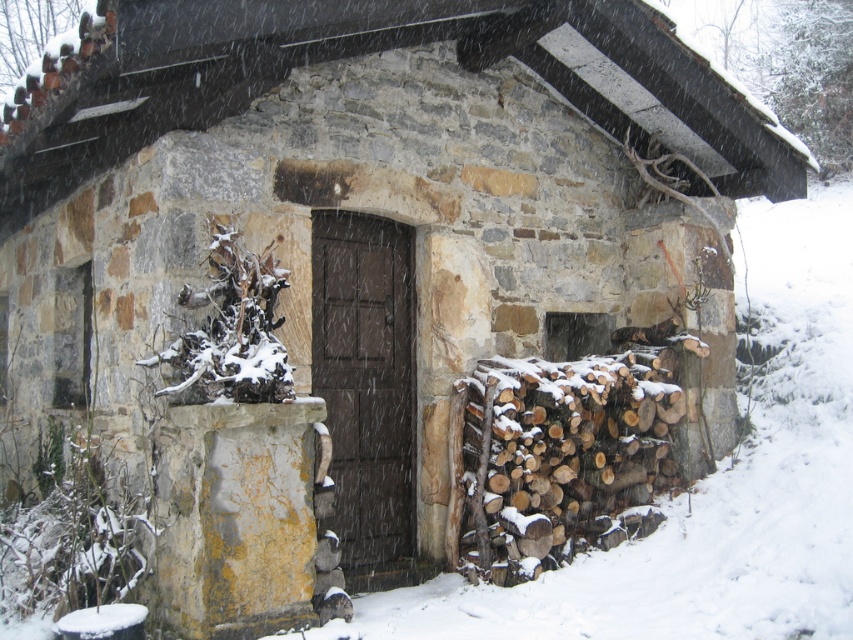
You are standing in front of the rustic stone building and want to determine which of the two points, point (x=607, y=520) or point (x=350, y=224), is closer to you. Based on the scene description, which point is nearer?

Point (x=607, y=520) is further to the viewer than point (x=350, y=224), so point (x=350, y=224) is closer to you.